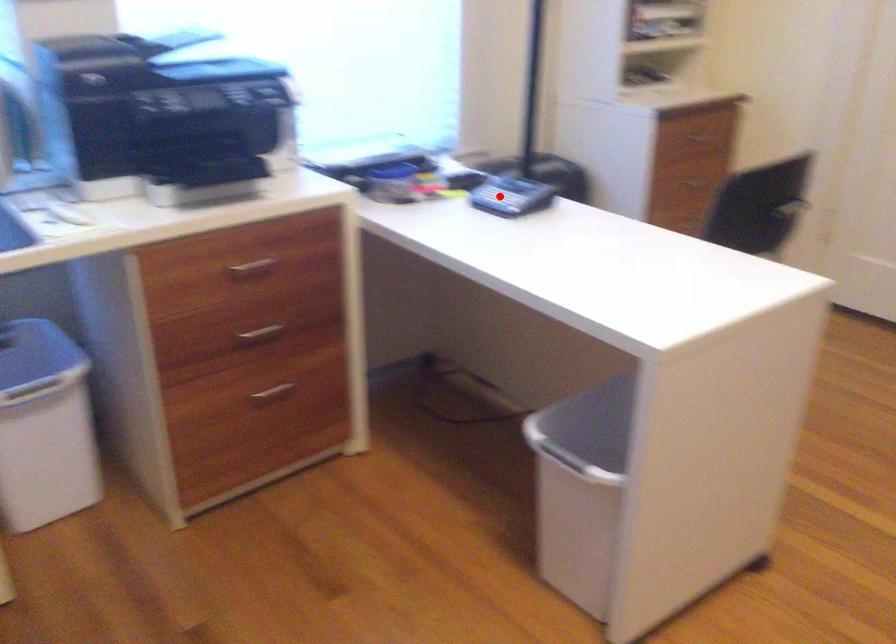
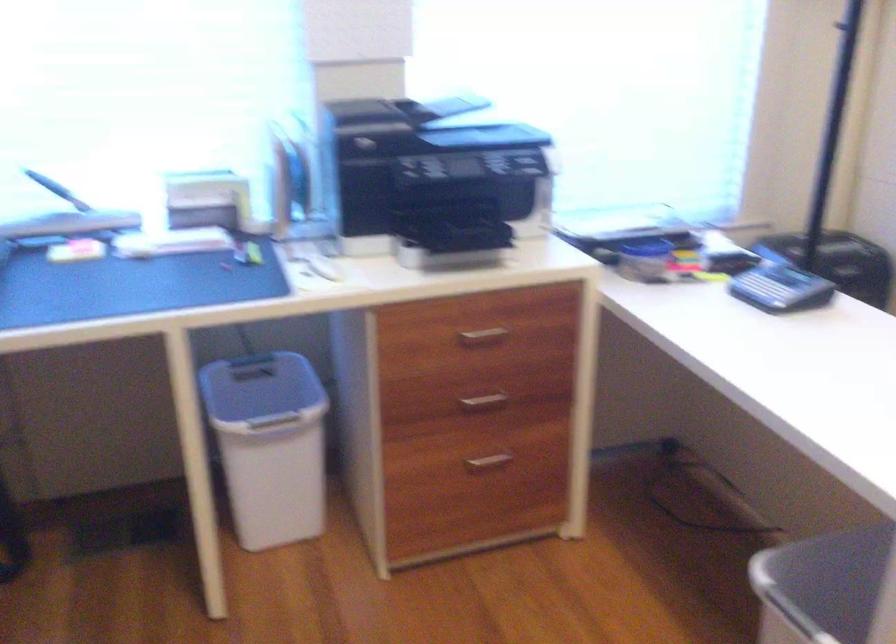
Question: I am providing you with two images of the same scene from different viewpoints. In image1, a red point is highlighted. Considering the same 3D point in image2, which of the following is correct?

Choices:
 (A) It is closer
 (B) It is farther

Answer: (A)